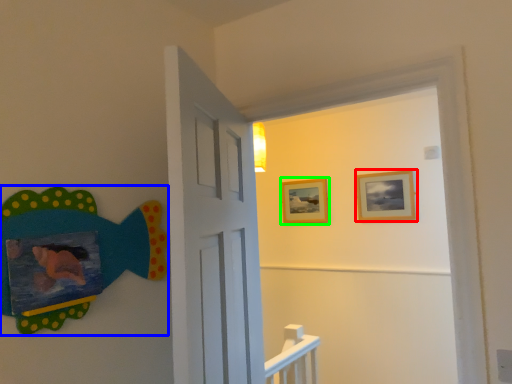
Question: Which object is positioned farthest from picture frame (highlighted by a red box)? Select from art (highlighted by a blue box) and picture frame (highlighted by a green box).

Choices:
 (A) art
 (B) picture frame

Answer: (A)